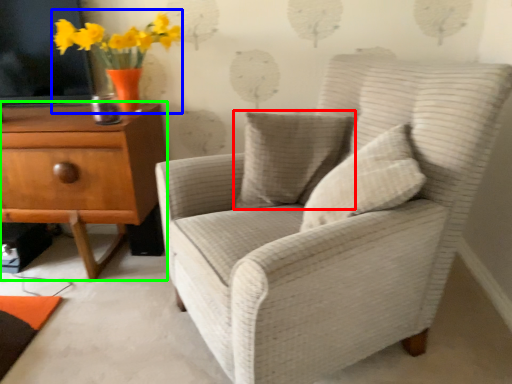
Question: Based on their relative distances, which object is nearer to pillow (highlighted by a red box)? Choose from floral arrangement (highlighted by a blue box) and chest of drawers (highlighted by a green box).

Choices:
 (A) floral arrangement
 (B) chest of drawers

Answer: (B)